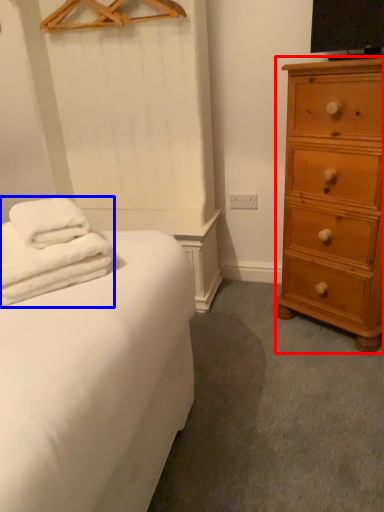
Question: Among these objects, which one is nearest to the camera, chest of drawers (highlighted by a red box) or bath towel (highlighted by a blue box)?

Choices:
 (A) chest of drawers
 (B) bath towel

Answer: (B)